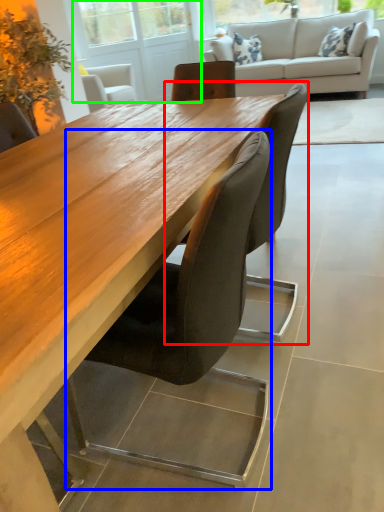
Question: Which object is positioned farthest from chair (highlighted by a red box)? Select from chair (highlighted by a blue box) and screen door (highlighted by a green box).

Choices:
 (A) chair
 (B) screen door

Answer: (B)